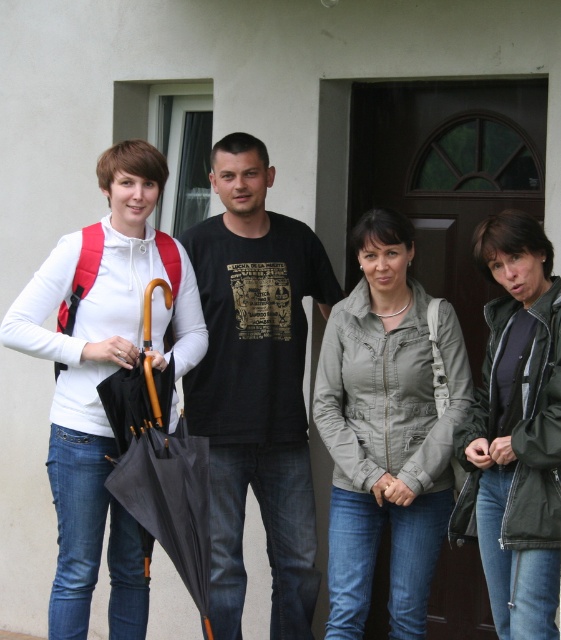
Consider the image. Does matte white hoodie at left have a greater width compared to black matte umbrella at left?

Yes.

In the scene shown: Is matte white hoodie at left to the left of black matte umbrella at left from the viewer's perspective?

Yes, matte white hoodie at left is to the left of black matte umbrella at left.

Which is behind, point (88, 397) or point (194, 477)?

The point (88, 397) is behind.

You are a GUI agent. You are given a task and a screenshot of the screen. Output one action in this format:
    pyautogui.click(x=<x>, y=<y>)
    Task: Click on the matte white hoodie at left
    The height and width of the screenshot is (640, 561).
    Given the screenshot: What is the action you would take?
    click(103, 380)

Does point (358, 316) lie in front of point (200, 580)?

No, it is behind (200, 580).

Can you confirm if matte khaki jacket at center is positioned below black matte umbrella at left?

No.

Where is `matte khaki jacket at center`? The height and width of the screenshot is (640, 561). matte khaki jacket at center is located at coordinates (387, 429).

Can you confirm if matte khaki jacket at center is shorter than matte white hoodie at left?

Yes, matte khaki jacket at center is shorter than matte white hoodie at left.

Based on the photo, does matte khaki jacket at center appear over matte white hoodie at left?

Incorrect, matte khaki jacket at center is not positioned above matte white hoodie at left.

What do you see at coordinates (387, 429) in the screenshot?
I see `matte khaki jacket at center` at bounding box center [387, 429].

Where is `matte khaki jacket at center`? This screenshot has width=561, height=640. matte khaki jacket at center is located at coordinates (387, 429).